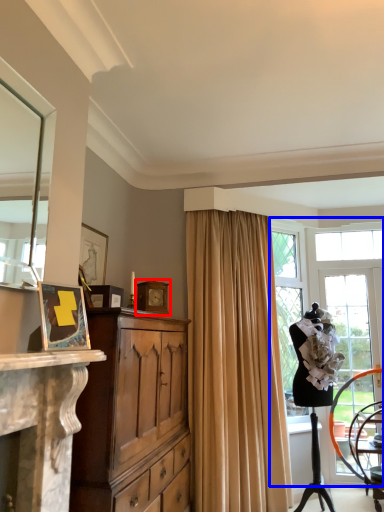
Question: Which object appears closest to the camera in this image, picture frame (highlighted by a red box) or window (highlighted by a blue box)?

Choices:
 (A) picture frame
 (B) window

Answer: (B)